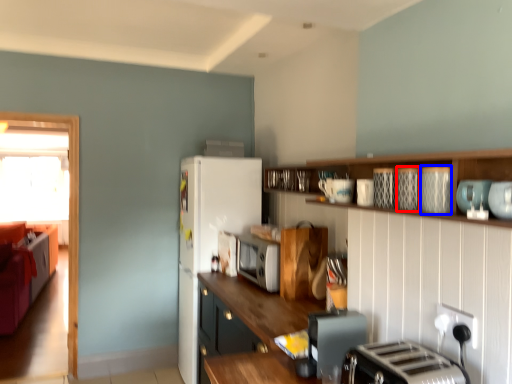
Question: Which of the following is the farthest to the observer, appliance (highlighted by a red box) or appliance (highlighted by a blue box)?

Choices:
 (A) appliance
 (B) appliance

Answer: (A)